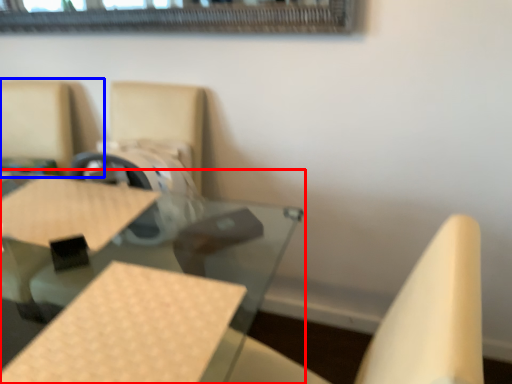
Question: Which object is further to the camera taking this photo, table (highlighted by a red box) or chair (highlighted by a blue box)?

Choices:
 (A) table
 (B) chair

Answer: (B)